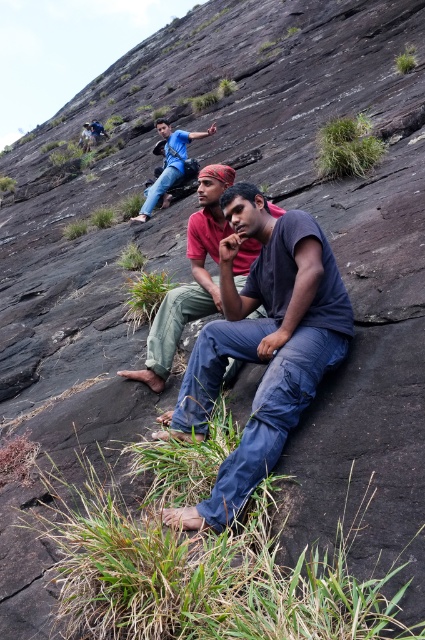
Can you confirm if dark blue cotton shirt at center is taller than dark blue jeans at center?

Yes.

Describe the element at coordinates (263, 346) in the screenshot. I see `dark blue cotton shirt at center` at that location.

Describe the element at coordinates (263, 346) in the screenshot. The height and width of the screenshot is (640, 425). I see `dark blue cotton shirt at center` at that location.

Where is `dark blue cotton shirt at center`? dark blue cotton shirt at center is located at coordinates (263, 346).